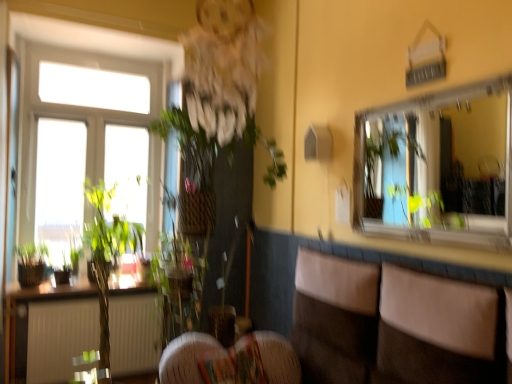
Question: Does clear glass mirror at upper right have a larger size compared to brown leather couch at lower right?

Choices:
 (A) yes
 (B) no

Answer: (B)

Question: Is clear glass mirror at upper right to the left of brown leather couch at lower right from the viewer's perspective?

Choices:
 (A) no
 (B) yes

Answer: (A)

Question: From a real-world perspective, is clear glass mirror at upper right under brown leather couch at lower right?

Choices:
 (A) no
 (B) yes

Answer: (A)

Question: Is clear glass mirror at upper right positioned with its back to brown leather couch at lower right?

Choices:
 (A) no
 (B) yes

Answer: (A)

Question: Does clear glass mirror at upper right have a smaller size compared to brown leather couch at lower right?

Choices:
 (A) no
 (B) yes

Answer: (B)

Question: From the image's perspective, is clear glass mirror at upper right under brown leather couch at lower right?

Choices:
 (A) yes
 (B) no

Answer: (B)

Question: From the image's perspective, does brown leather couch at lower right appear lower than clear glass mirror at upper right?

Choices:
 (A) yes
 (B) no

Answer: (A)

Question: Does brown leather couch at lower right lie behind clear glass mirror at upper right?

Choices:
 (A) no
 (B) yes

Answer: (A)

Question: Can you confirm if brown leather couch at lower right is bigger than clear glass mirror at upper right?

Choices:
 (A) yes
 (B) no

Answer: (A)

Question: Can you confirm if brown leather couch at lower right is positioned to the right of clear glass mirror at upper right?

Choices:
 (A) yes
 (B) no

Answer: (B)

Question: Is brown leather couch at lower right not close to clear glass mirror at upper right?

Choices:
 (A) yes
 (B) no

Answer: (A)

Question: Can you confirm if brown leather couch at lower right is taller than clear glass mirror at upper right?

Choices:
 (A) no
 (B) yes

Answer: (A)

Question: Considering the positions of brown leather couch at lower right and clear glass mirror at upper right in the image, is brown leather couch at lower right taller or shorter than clear glass mirror at upper right?

Choices:
 (A) tall
 (B) short

Answer: (B)